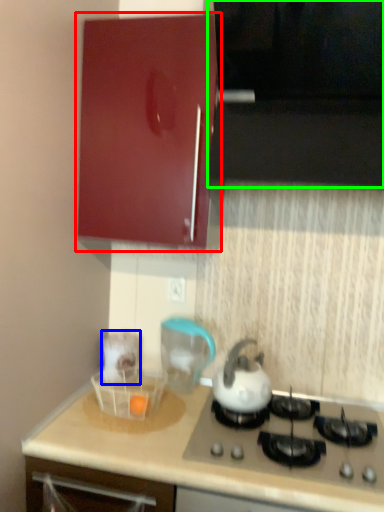
Question: Which object is the closest to the cabinetry (highlighted by a red box)? Choose among these: appliance (highlighted by a blue box) or vent (highlighted by a green box).

Choices:
 (A) appliance
 (B) vent

Answer: (B)